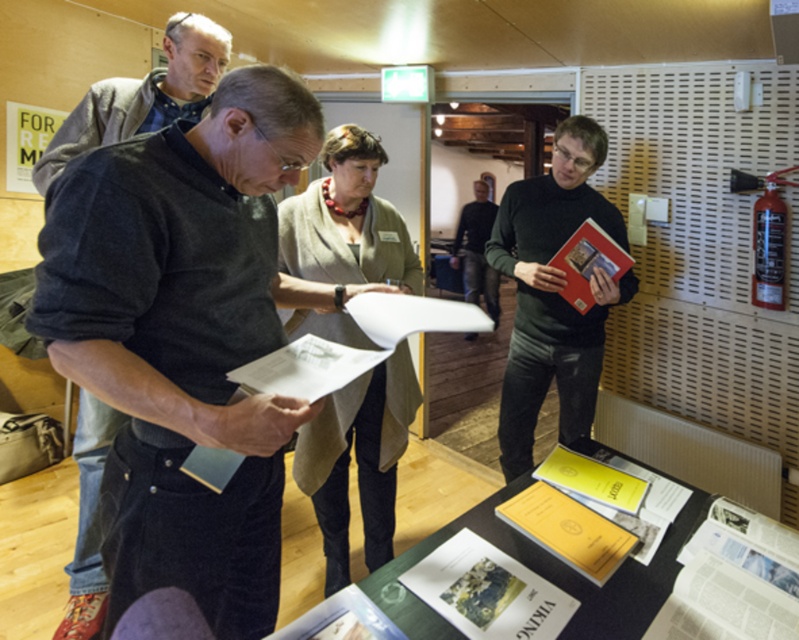
Between matte black book at right and paper-covered table at center, which one is positioned higher?

matte black book at right

Between matte black book at right and paper-covered table at center, which one appears on the right side from the viewer's perspective?

From the viewer's perspective, matte black book at right appears more on the right side.

Where is `matte black book at right`? The height and width of the screenshot is (640, 799). matte black book at right is located at coordinates pyautogui.click(x=553, y=292).

Between point (547, 330) and point (483, 186), which one is positioned behind?

Positioned behind is point (483, 186).

Between matte black book at right and dark gray sweater at center, which one appears on the left side from the viewer's perspective?

matte black book at right is more to the left.

What do you see at coordinates (553, 292) in the screenshot? I see `matte black book at right` at bounding box center [553, 292].

Locate an element on the screen. The image size is (799, 640). matte black book at right is located at coordinates (553, 292).

Describe the element at coordinates (702, 244) in the screenshot. Image resolution: width=799 pixels, height=640 pixels. I see `metallic perforated board at right` at that location.

Does metallic perforated board at right have a greater height compared to dark gray sweater at center?

Indeed, metallic perforated board at right has a greater height compared to dark gray sweater at center.

At what (x,y) coordinates should I click in order to perform the action: click on metallic perforated board at right. Please return your answer as a coordinate pair (x, y). The width and height of the screenshot is (799, 640). Looking at the image, I should click on (702, 244).